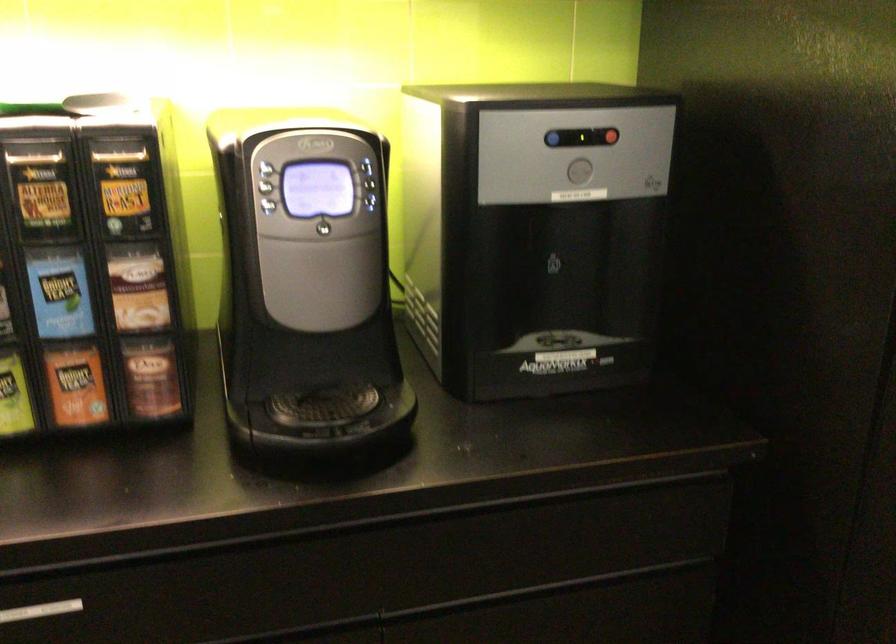
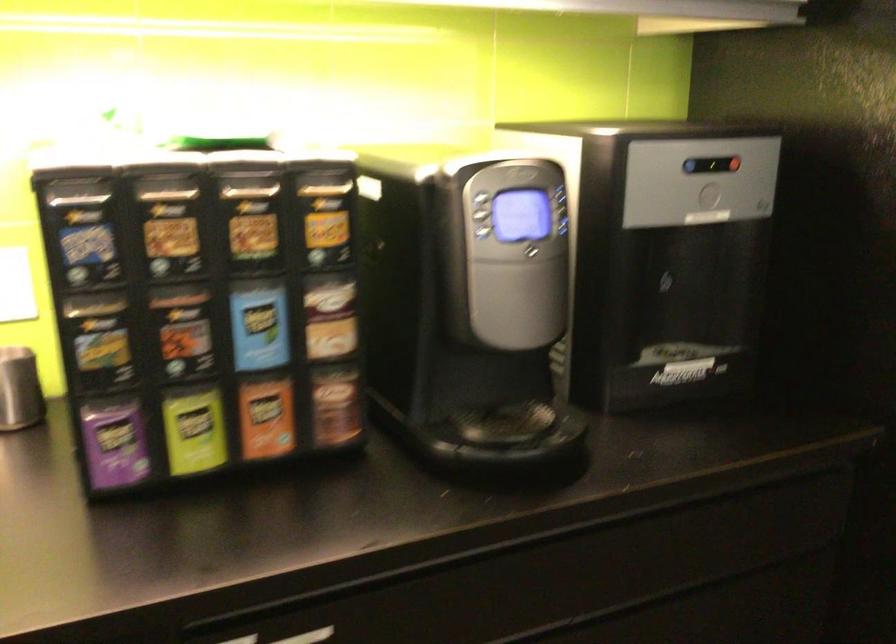
The point at [325,229] is marked in the first image. Where is the corresponding point in the second image?

(533, 252)